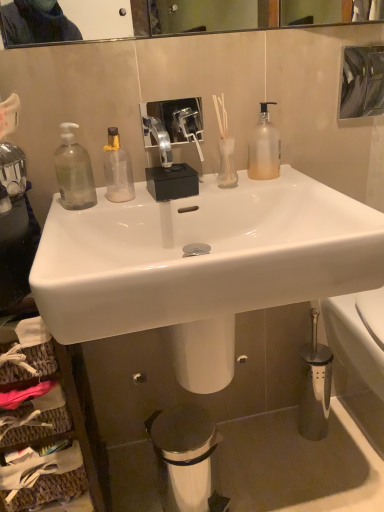
Where is `vacant area that is in front of frosted glass pump bottle at upper right, the first bottle positioned from the right`? The height and width of the screenshot is (512, 384). vacant area that is in front of frosted glass pump bottle at upper right, the first bottle positioned from the right is located at coordinates (288, 184).